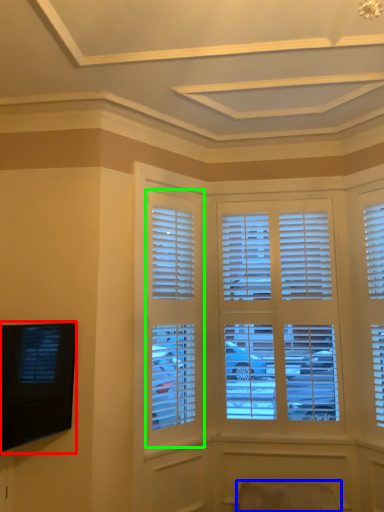
Question: Which object is the farthest from television (highlighted by a red box)? Choose among these: swivel chair (highlighted by a blue box) or window (highlighted by a green box).

Choices:
 (A) swivel chair
 (B) window

Answer: (A)